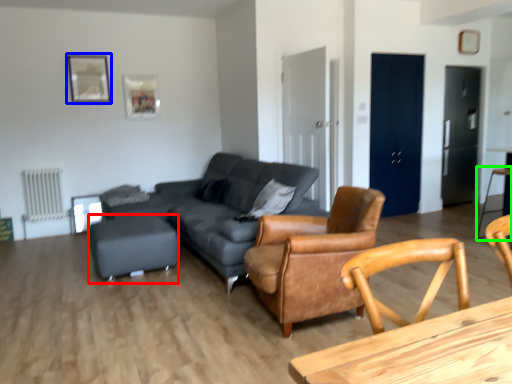
Question: Estimate the real-world distances between objects in this image. Which object is closer to bar stool (highlighted by a red box), picture frame (highlighted by a blue box) or bar stool (highlighted by a green box)?

Choices:
 (A) picture frame
 (B) bar stool

Answer: (A)